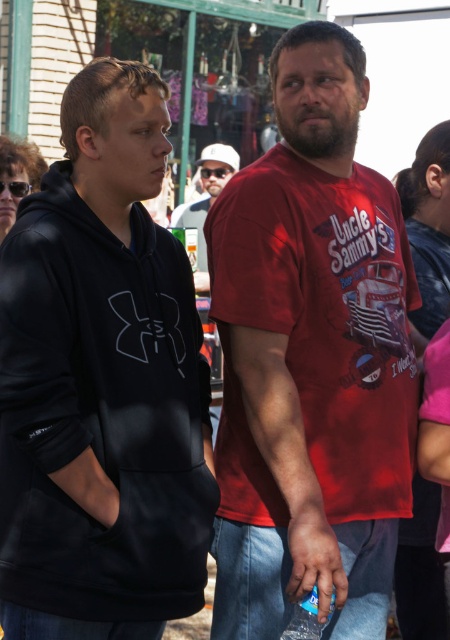
Who is shorter, black fleece hoodie at left or matte white cap at center?

matte white cap at center

Is point (91, 140) positioned after point (228, 177)?

No, (91, 140) is closer to viewer.

Is point (166, 536) in front of point (202, 282)?

Yes, it is.

The height and width of the screenshot is (640, 450). Find the location of `black fleece hoodie at left`. black fleece hoodie at left is located at coordinates (102, 384).

Does black fleece hoodie at left appear on the left side of red cotton t-shirt at center?

Indeed, black fleece hoodie at left is positioned on the left side of red cotton t-shirt at center.

Is black fleece hoodie at left smaller than red cotton t-shirt at center?

Yes, black fleece hoodie at left is smaller than red cotton t-shirt at center.

Who is more distant from viewer, (147, 484) or (280, 477)?

Positioned behind is point (280, 477).

Locate an element on the screen. This screenshot has height=640, width=450. black fleece hoodie at left is located at coordinates (102, 384).

Which is in front, point (283, 371) or point (178, 224)?

Positioned in front is point (283, 371).

Who is more forward, (x=302, y=401) or (x=207, y=211)?

Point (x=302, y=401)

I want to click on red cotton t-shirt at center, so click(311, 358).